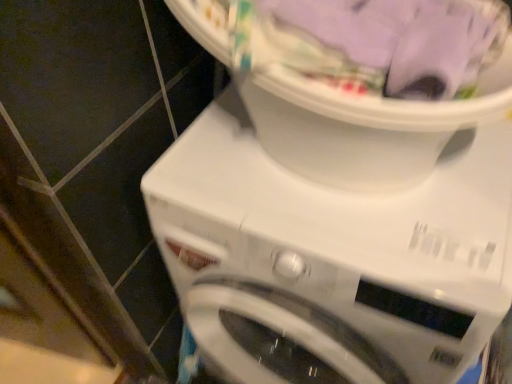
Question: Is white plastic washing machine at center not within white plastic laundry basket at upper center?

Choices:
 (A) no
 (B) yes

Answer: (B)

Question: Is white plastic washing machine at center facing away from white plastic laundry basket at upper center?

Choices:
 (A) yes
 (B) no

Answer: (B)

Question: Does white plastic washing machine at center touch white plastic laundry basket at upper center?

Choices:
 (A) yes
 (B) no

Answer: (B)

Question: Is white plastic washing machine at center bigger than white plastic laundry basket at upper center?

Choices:
 (A) no
 (B) yes

Answer: (B)

Question: Would you consider white plastic washing machine at center to be distant from white plastic laundry basket at upper center?

Choices:
 (A) yes
 (B) no

Answer: (B)

Question: Considering the relative sizes of white plastic washing machine at center and white plastic laundry basket at upper center in the image provided, is white plastic washing machine at center smaller than white plastic laundry basket at upper center?

Choices:
 (A) yes
 (B) no

Answer: (B)

Question: Can you confirm if white plastic laundry basket at upper center is wider than white plastic washing machine at center?

Choices:
 (A) no
 (B) yes

Answer: (A)

Question: Would you say white plastic laundry basket at upper center is outside white plastic washing machine at center?

Choices:
 (A) no
 (B) yes

Answer: (B)

Question: Is white plastic laundry basket at upper center aimed at white plastic washing machine at center?

Choices:
 (A) no
 (B) yes

Answer: (A)

Question: Can you confirm if white plastic laundry basket at upper center is bigger than white plastic washing machine at center?

Choices:
 (A) no
 (B) yes

Answer: (A)

Question: Is the position of white plastic laundry basket at upper center more distant than that of white plastic washing machine at center?

Choices:
 (A) no
 (B) yes

Answer: (A)

Question: Considering the relative positions of white plastic laundry basket at upper center and white plastic washing machine at center in the image provided, is white plastic laundry basket at upper center to the left of white plastic washing machine at center from the viewer's perspective?

Choices:
 (A) yes
 (B) no

Answer: (A)

Question: Is white plastic laundry basket at upper center taller or shorter than white plastic washing machine at center?

Choices:
 (A) tall
 (B) short

Answer: (B)